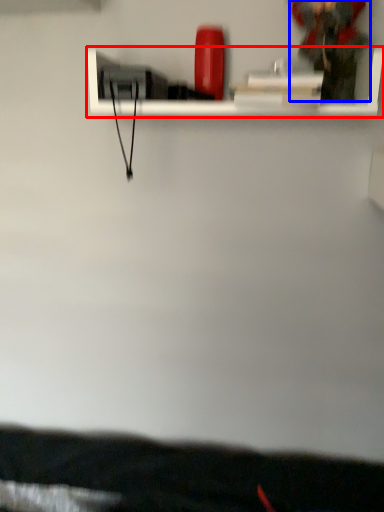
Question: Among these objects, which one is nearest to the camera, shelf (highlighted by a red box) or person (highlighted by a blue box)?

Choices:
 (A) shelf
 (B) person

Answer: (A)